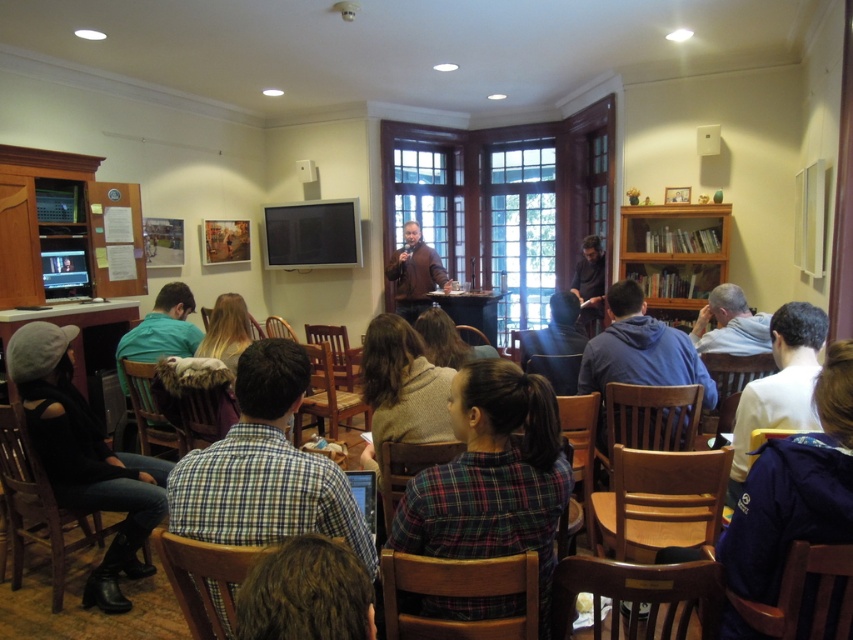
You are a guest attending the event and need to place your dark brown leather jacket at center on a surface. Can the wooden table at lower left accommodate it in terms of height?

The wooden table at lower left has a lesser height compared to dark brown leather jacket at center, so the table is shorter than the jacket. Therefore, the jacket might not rest stably on the table due to the height difference.